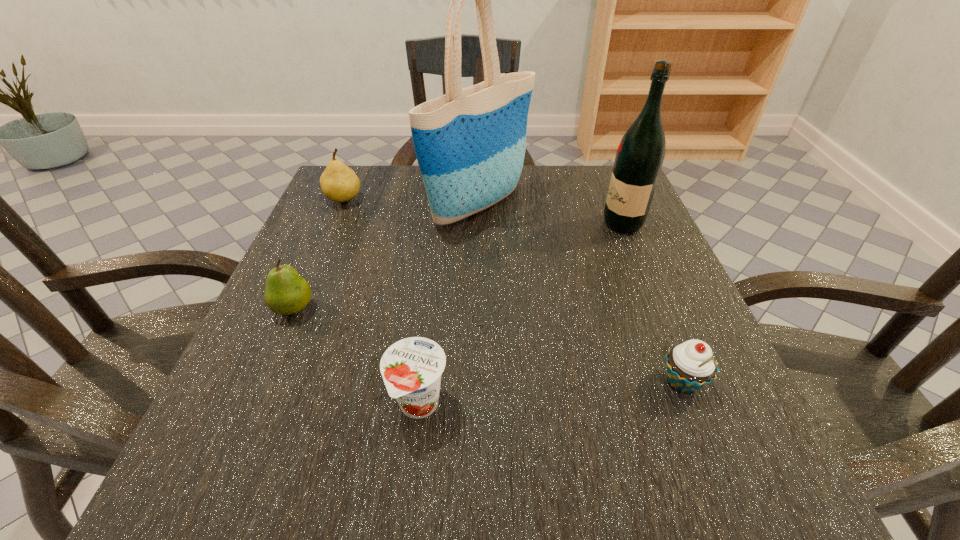
Image resolution: width=960 pixels, height=540 pixels. Identify the location of tote bag. (470, 143).

Where is `the fifth shortest object`? the fifth shortest object is located at coordinates (640, 155).

At what (x,y) coordinates should I click in order to perform the action: click on the taller pear. Please return your answer as a coordinate pair (x, y). The image size is (960, 540). Looking at the image, I should click on (339, 183).

This screenshot has height=540, width=960. Find the location of `the third tallest object`. the third tallest object is located at coordinates [x=339, y=183].

This screenshot has width=960, height=540. Identify the location of the nearer pear. (286, 293).

Find the location of `the shorter pear`. the shorter pear is located at coordinates (286, 293).

The height and width of the screenshot is (540, 960). I want to click on cupcake, so click(x=690, y=366).

This screenshot has height=540, width=960. I want to click on yogurt, so click(411, 368).

The height and width of the screenshot is (540, 960). What are the coordinates of `vacant region located on the left of the tote bag` in the screenshot? It's located at (329, 206).

Where is `vacant space positioned 0.280m on the front-facing side of the liquor`? The image size is (960, 540). vacant space positioned 0.280m on the front-facing side of the liquor is located at coordinates (473, 224).